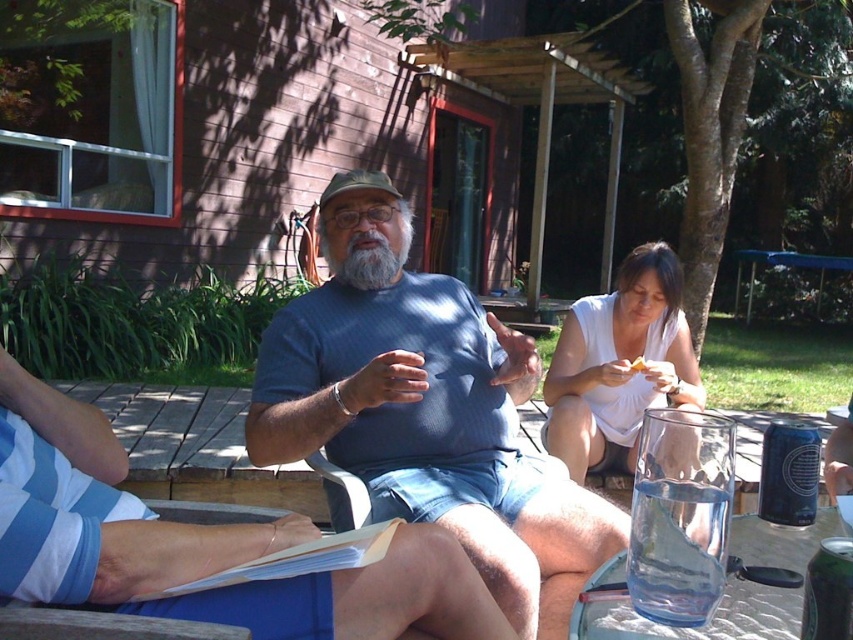
You are standing in the backyard and want to place a small potted plant exactly at point (403, 534). If you are currently 5 feet away from that point, how many more feet do you need to move forward to reach it?

The distance of point (403, 534) from viewer is 3.44 feet. Since you are currently 5 feet away, you need to move forward 5 minus 3.44 equals 1.56 feet.

Looking at this image, you are a photographer taking a group photo of the people at the gathering. You want to ensure both the blue striped shirt at center and the white paper at center are clearly visible in the photo. Given their sizes, which object should you focus on to ensure both are in frame?

The blue striped shirt at center is bigger than the white paper at center, so focusing on the blue striped shirt at center will ensure both are in frame as it takes up more space.